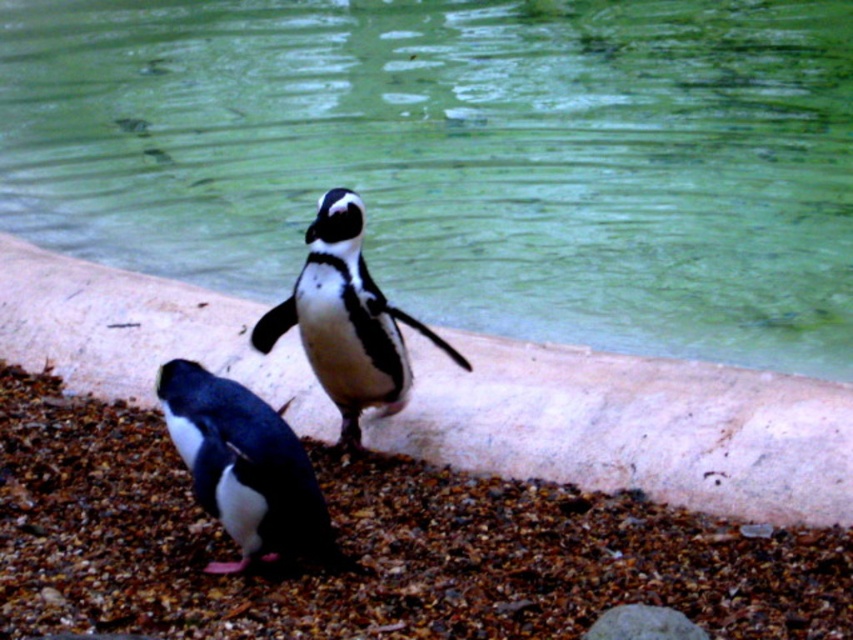
You are a photographer trying to capture both the white stone ledge at center and the black matte penguin at lower left in a single frame. Based on their positions, which object should you adjust your camera to focus on first to ensure both are in the shot?

You should focus on the white stone ledge at center first because it is positioned to the right of the black matte penguin at lower left, so adjusting the frame to include the right side ensures both are captured.

You are a photographer trying to capture the black matte penguin at lower left and the white stone ledge at center in the same frame. Based on their positions, will the penguin be visible behind the ledge?

The black matte penguin at lower left is behind the white stone ledge at center, so it may not be fully visible in the photo if the ledge obstructs the view.